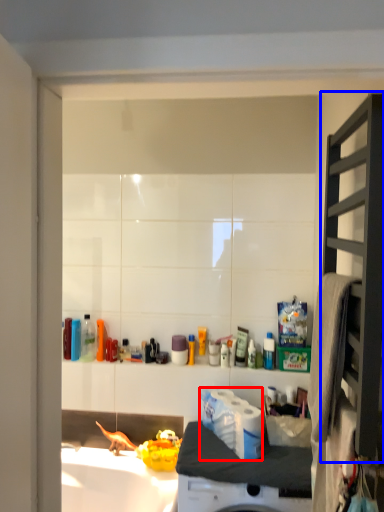
Question: Which point is closer to the camera, toilet paper (highlighted by a red box) or shelf (highlighted by a blue box)?

Choices:
 (A) toilet paper
 (B) shelf

Answer: (B)